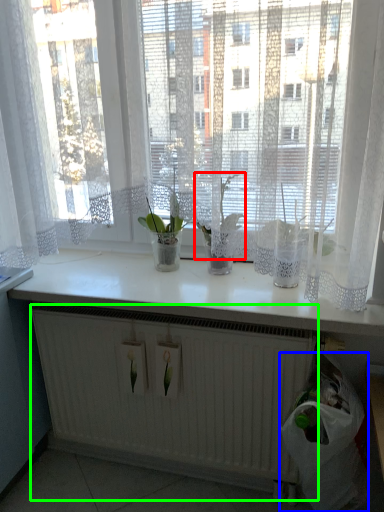
Question: Which is farther away from orchid (highlighted by a red box)? garbage (highlighted by a blue box) or radiator (highlighted by a green box)?

Choices:
 (A) garbage
 (B) radiator

Answer: (B)